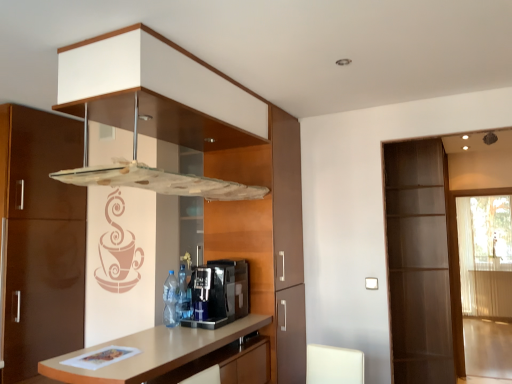
Question: From the image's perspective, relative to blue plastic bottle at center, arranged as the 1th bottle when viewed from the back, is light brown wood countertop at center above or below?

Choices:
 (A) below
 (B) above

Answer: (A)

Question: Is light brown wood countertop at center inside the boundaries of blue plastic bottle at center, arranged as the 1th bottle when viewed from the back, or outside?

Choices:
 (A) inside
 (B) outside

Answer: (B)

Question: Which of these objects is positioned closest to the blue plastic bottle at center, arranged as the 1th bottle when viewed from the back?

Choices:
 (A) light brown wood countertop at center
 (B) black plastic coffee machine at center
 (C) transparent glass screen door at right, marked as the 2th screen door in a right-to-left arrangement
 (D) blue plastic bottle at center, which is the second bottle from back to front
 (E) transparent glass exhaust hood at upper center

Answer: (D)

Question: Estimate the real-world distances between objects in this image. Which object is closer to the transparent glass exhaust hood at upper center?

Choices:
 (A) translucent white screen door at right, acting as the first screen door starting from the right
 (B) transparent glass screen door at right, marked as the 2th screen door in a right-to-left arrangement
 (C) blue plastic bottle at center, which appears as the second bottle when viewed from the front
 (D) black plastic coffee machine at center
 (E) blue plastic bottle at center, which is the second bottle from back to front

Answer: (D)